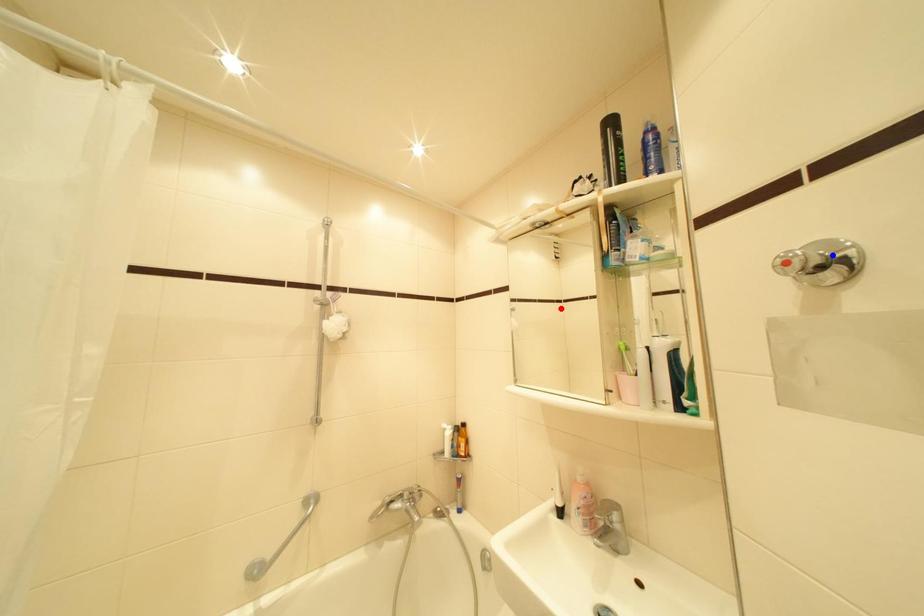
Question: Two points are marked on the image. Which point is closer to the camera?

Choices:
 (A) Blue point is closer.
 (B) Red point is closer.

Answer: (A)